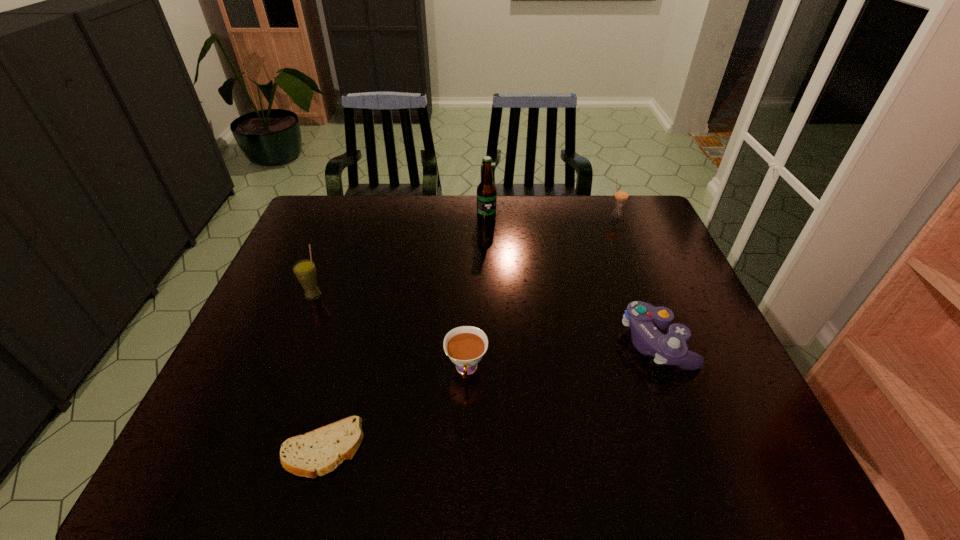
You are a GUI agent. You are given a task and a screenshot of the screen. Output one action in this format:
    pyautogui.click(x=<x>, y=<y>)
    Task: Click on the control at the right edge
    This screenshot has height=540, width=960.
    Given the screenshot: What is the action you would take?
    pyautogui.click(x=643, y=318)

At what (x,y) coordinates should I click in order to perform the action: click on object that is at the far right corner. Please return your answer as a coordinate pair (x, y). Image resolution: width=960 pixels, height=540 pixels. Looking at the image, I should click on (x=621, y=194).

Where is `vacant space at the far edge`? vacant space at the far edge is located at coordinates (538, 209).

Where is `vacant space at the near edge of the desktop`? vacant space at the near edge of the desktop is located at coordinates (663, 476).

Where is `free space at the left edge`? free space at the left edge is located at coordinates (342, 239).

Identify the location of vacant area at the right edge of the desktop. The height and width of the screenshot is (540, 960). (630, 242).

You are a GUI agent. You are given a task and a screenshot of the screen. Output one action in this format:
    pyautogui.click(x=<x>, y=<y>)
    Task: Click on the vacant space at the far left corner of the desktop
    This screenshot has height=540, width=960.
    Given the screenshot: What is the action you would take?
    pyautogui.click(x=313, y=213)

At what (x,y) coordinates should I click in order to perform the action: click on vacant space at the near left corner of the desktop. Please return your answer as a coordinate pair (x, y). Looking at the image, I should click on (239, 446).

Locate an element on the screen. vacant region at the near right corner of the desktop is located at coordinates (732, 471).

Find the location of `vacant space in between the control and the shortest object`. vacant space in between the control and the shortest object is located at coordinates (490, 396).